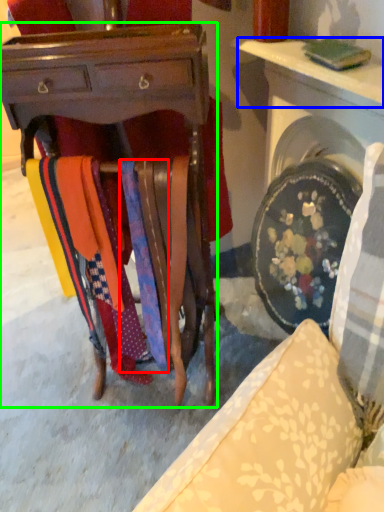
Question: Which object is positioned farthest from tie (highlighted by a red box)? Select from table (highlighted by a blue box) and desk (highlighted by a green box).

Choices:
 (A) table
 (B) desk

Answer: (A)